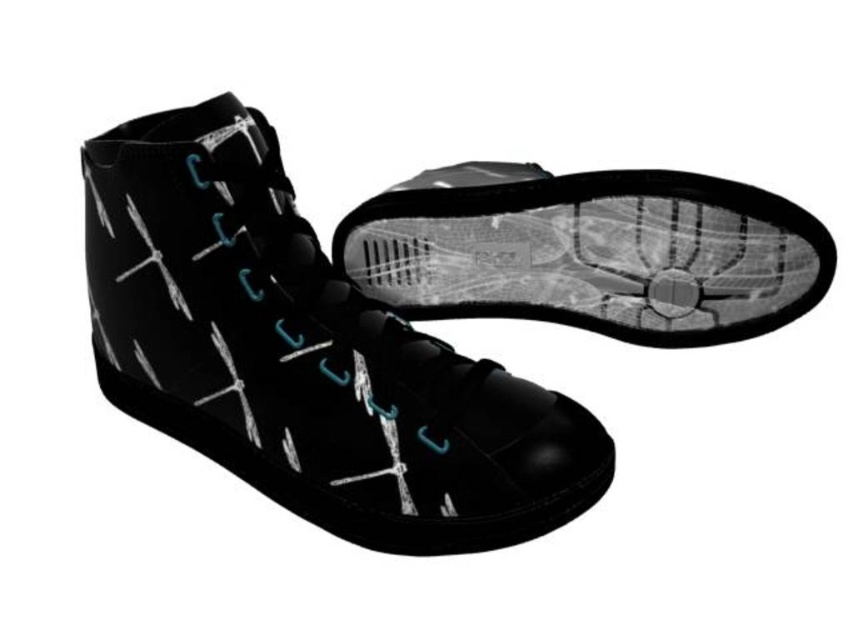
Based on the photo, is black matte high-top boot at center to the left of black matte shoe at center from the viewer's perspective?

Correct, you'll find black matte high-top boot at center to the left of black matte shoe at center.

What do you see at coordinates (306, 355) in the screenshot? I see `black matte high-top boot at center` at bounding box center [306, 355].

Between point (294, 337) and point (386, 285), which one is positioned in front?

Point (294, 337) is in front.

Identify the location of black matte high-top boot at center. The image size is (853, 640). click(306, 355).